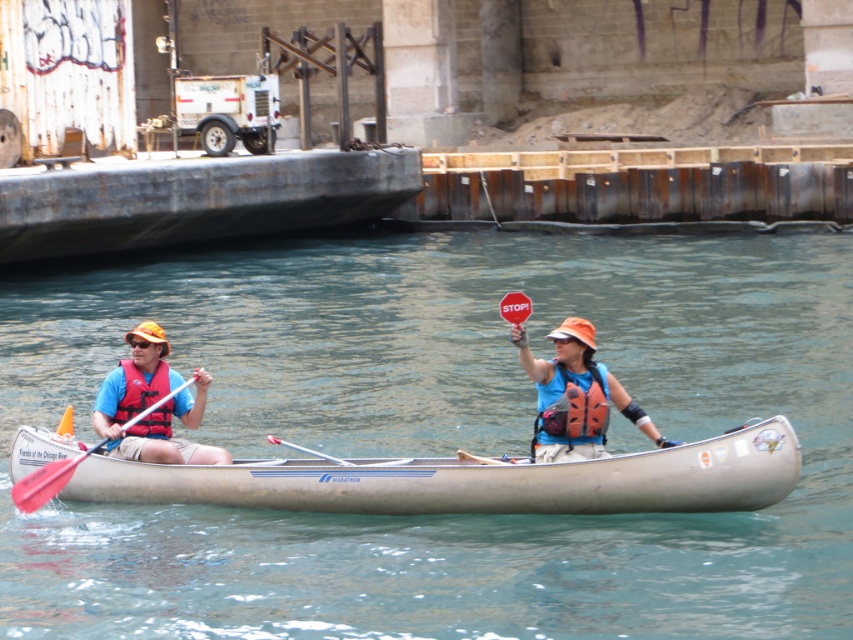
Question: Among these points, which one is nearest to the camera?

Choices:
 (A) (120, 428)
 (B) (172, 627)
 (C) (155, 380)
 (D) (601, 388)

Answer: (B)

Question: Is clear blue water at center bigger than matte blue life vest at center?

Choices:
 (A) yes
 (B) no

Answer: (A)

Question: Is the position of rusty metal barge at upper center more distant than that of smooth white paddle at center?

Choices:
 (A) yes
 (B) no

Answer: (A)

Question: Does rusty metal barge at upper center have a greater width compared to red plastic paddle at left?

Choices:
 (A) yes
 (B) no

Answer: (A)

Question: Estimate the real-world distances between objects in this image. Which object is closer to the silver metallic canoe at center?

Choices:
 (A) blue life vest at left
 (B) orange life vest at center

Answer: (B)

Question: Based on their relative distances, which object is farther from the silver metallic canoe at center?

Choices:
 (A) blue life vest at left
 (B) matte blue life vest at center
 (C) clear blue water at center
 (D) rusty metal barge at upper center

Answer: (D)